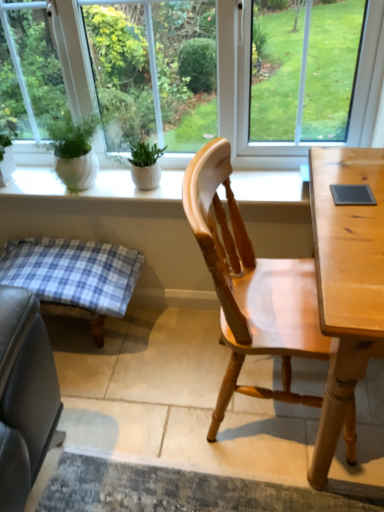
Question: Is white ceramic plant pots at upper center closer to camera compared to blue plaid cushion at lower left?

Choices:
 (A) yes
 (B) no

Answer: (B)

Question: Considering the relative sizes of white ceramic plant pots at upper center and blue plaid cushion at lower left in the image provided, is white ceramic plant pots at upper center shorter than blue plaid cushion at lower left?

Choices:
 (A) no
 (B) yes

Answer: (B)

Question: Would you say white ceramic plant pots at upper center is outside blue plaid cushion at lower left?

Choices:
 (A) yes
 (B) no

Answer: (A)

Question: Does white ceramic plant pots at upper center have a smaller size compared to blue plaid cushion at lower left?

Choices:
 (A) yes
 (B) no

Answer: (A)

Question: Is white ceramic plant pots at upper center thinner than blue plaid cushion at lower left?

Choices:
 (A) no
 (B) yes

Answer: (B)

Question: From the image's perspective, is white ceramic plant pots at upper center on blue plaid cushion at lower left?

Choices:
 (A) yes
 (B) no

Answer: (A)

Question: Can you confirm if blue plaid cushion at lower left is positioned to the right of white ceramic plant pots at upper center?

Choices:
 (A) no
 (B) yes

Answer: (A)

Question: Can you confirm if blue plaid cushion at lower left is bigger than white ceramic plant pots at upper center?

Choices:
 (A) no
 (B) yes

Answer: (B)

Question: Is blue plaid cushion at lower left turned away from white ceramic plant pots at upper center?

Choices:
 (A) yes
 (B) no

Answer: (B)

Question: Can you confirm if blue plaid cushion at lower left is smaller than white ceramic plant pots at upper center?

Choices:
 (A) yes
 (B) no

Answer: (B)

Question: Would you say blue plaid cushion at lower left is a long distance from white ceramic plant pots at upper center?

Choices:
 (A) no
 (B) yes

Answer: (A)

Question: Does blue plaid cushion at lower left have a greater height compared to white ceramic plant pots at upper center?

Choices:
 (A) no
 (B) yes

Answer: (B)

Question: Considering the relative sizes of transparent glass window at center and white ceramic plant pots at upper center in the image provided, is transparent glass window at center thinner than white ceramic plant pots at upper center?

Choices:
 (A) yes
 (B) no

Answer: (A)